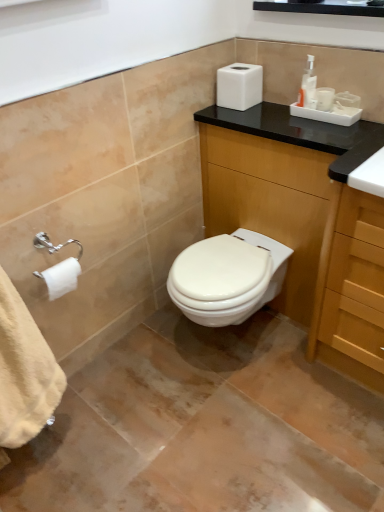
Question: From the image's perspective, relative to white matte toilet paper at left, is wooden cabinet at center above or below?

Choices:
 (A) above
 (B) below

Answer: (A)

Question: Is wooden cabinet at center in front of or behind white matte toilet paper at left in the image?

Choices:
 (A) behind
 (B) front

Answer: (B)

Question: Based on their relative distances, which object is farther from the black glossy medicine cabinet at upper center?

Choices:
 (A) white matte toilet paper at left
 (B) translucent plastic pump bottle at upper right
 (C) wooden cabinet at center

Answer: (A)

Question: Which of these objects is positioned closest to the wooden cabinet at center?

Choices:
 (A) white matte toilet paper at left
 (B) black glossy medicine cabinet at upper center
 (C) translucent plastic pump bottle at upper right

Answer: (C)